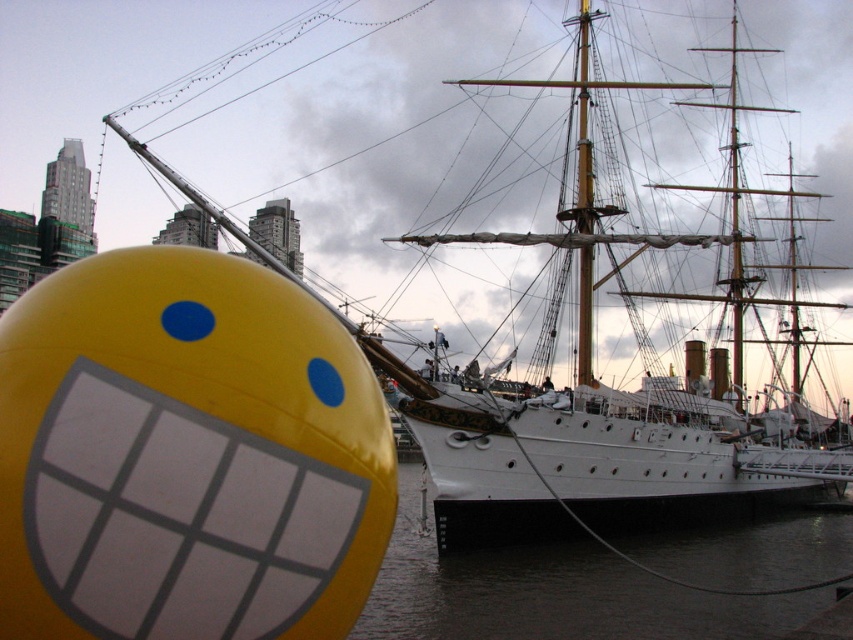
Question: Can you confirm if yellow matte bobfloat at lower left is positioned to the left of dark water at lower center?

Choices:
 (A) no
 (B) yes

Answer: (B)

Question: Among these points, which one is farthest from the camera?

Choices:
 (A) (225, 563)
 (B) (410, 561)

Answer: (B)

Question: Is yellow matte bobfloat at lower left in front of dark water at lower center?

Choices:
 (A) yes
 (B) no

Answer: (A)

Question: Which point is closer to the camera?

Choices:
 (A) dark water at lower center
 (B) yellow matte bobfloat at lower left

Answer: (B)

Question: Is yellow matte bobfloat at lower left positioned in front of dark water at lower center?

Choices:
 (A) yes
 (B) no

Answer: (A)